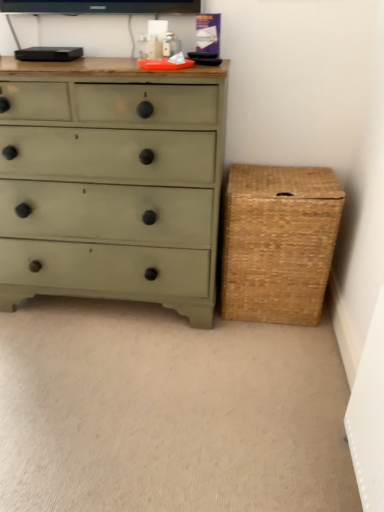
Question: Should I look upward or downward to see matte green chest of drawers at left?

Choices:
 (A) up
 (B) down

Answer: (A)

Question: Is woven brown basket at right bigger than matte green chest of drawers at left?

Choices:
 (A) yes
 (B) no

Answer: (B)

Question: Does woven brown basket at right have a greater width compared to matte green chest of drawers at left?

Choices:
 (A) yes
 (B) no

Answer: (B)

Question: Considering the relative positions of woven brown basket at right and matte green chest of drawers at left in the image provided, is woven brown basket at right in front of matte green chest of drawers at left?

Choices:
 (A) yes
 (B) no

Answer: (B)

Question: Does woven brown basket at right contain matte green chest of drawers at left?

Choices:
 (A) yes
 (B) no

Answer: (B)

Question: From a real-world perspective, is woven brown basket at right located higher than matte green chest of drawers at left?

Choices:
 (A) no
 (B) yes

Answer: (A)

Question: Is woven brown basket at right outside matte green chest of drawers at left?

Choices:
 (A) yes
 (B) no

Answer: (A)

Question: Does matte green chest of drawers at left touch woven brown basket at right?

Choices:
 (A) yes
 (B) no

Answer: (B)

Question: Can you confirm if matte green chest of drawers at left is wider than woven brown basket at right?

Choices:
 (A) no
 (B) yes

Answer: (B)

Question: Is matte green chest of drawers at left located outside woven brown basket at right?

Choices:
 (A) yes
 (B) no

Answer: (A)

Question: Is matte green chest of drawers at left positioned with its back to woven brown basket at right?

Choices:
 (A) no
 (B) yes

Answer: (A)

Question: From a real-world perspective, is matte green chest of drawers at left beneath woven brown basket at right?

Choices:
 (A) no
 (B) yes

Answer: (A)

Question: Could you tell me if matte green chest of drawers at left is facing woven brown basket at right?

Choices:
 (A) yes
 (B) no

Answer: (B)

Question: In terms of height, does woven brown basket at right look taller or shorter compared to matte green chest of drawers at left?

Choices:
 (A) tall
 (B) short

Answer: (B)